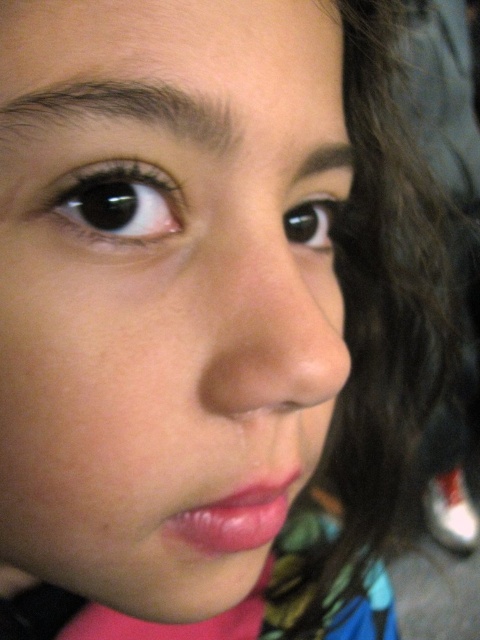
Can you confirm if dark brown hair at upper left is positioned below pink glossy lips at center?

No, dark brown hair at upper left is not below pink glossy lips at center.

Does point (24, 112) come farther from viewer compared to point (196, 532)?

No, (24, 112) is closer to viewer.

Find the location of a particular element. The width and height of the screenshot is (480, 640). dark brown hair at upper left is located at coordinates click(x=123, y=109).

Does dark brown hair at upper left have a lesser width compared to dark brown eyebrow at upper center?

Incorrect, dark brown hair at upper left's width is not less than dark brown eyebrow at upper center's.

Does dark brown hair at upper left come behind dark brown eyebrow at upper center?

No, it is not.

Image resolution: width=480 pixels, height=640 pixels. Describe the element at coordinates (123, 109) in the screenshot. I see `dark brown hair at upper left` at that location.

Identify the location of dark brown hair at upper left. (123, 109).

Consider the image. Does pink glossy lips at center have a smaller size compared to black glossy eye at center?

No.

Which of these two, pink glossy lips at center or black glossy eye at center, stands taller?

black glossy eye at center is taller.

Does point (252, 490) come in front of point (336, 205)?

Yes, it is.

Identify the location of pink glossy lips at center. Image resolution: width=480 pixels, height=640 pixels. (237, 516).